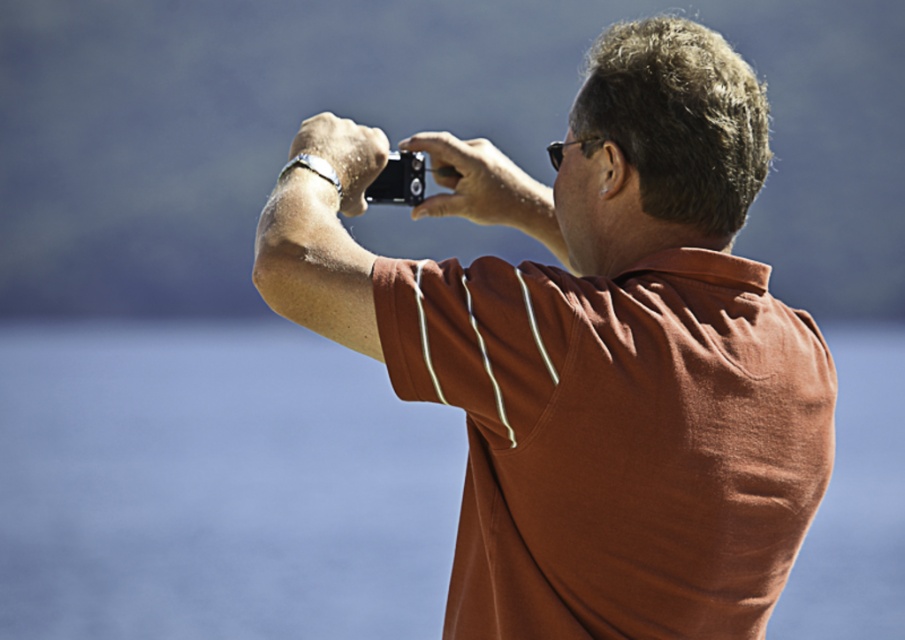
This screenshot has width=905, height=640. What do you see at coordinates (589, 349) in the screenshot?
I see `matte black camera at center` at bounding box center [589, 349].

Does point (627, 92) come in front of point (380, 195)?

Yes, it is.

Does point (303, 145) come farther from viewer compared to point (418, 198)?

No, it is in front of (418, 198).

Where is `matte black camera at center`? matte black camera at center is located at coordinates (589, 349).

Is transparent blue water at center thinner than black plastic camera at center?

No, transparent blue water at center is not thinner than black plastic camera at center.

Is transparent blue water at center above black plastic camera at center?

Incorrect, transparent blue water at center is not positioned above black plastic camera at center.

Does point (254, 480) come farther from viewer compared to point (386, 184)?

Yes, it is behind point (386, 184).

The height and width of the screenshot is (640, 905). I want to click on transparent blue water at center, so click(216, 486).

Who is more forward, [767,474] or [376,456]?

Point [767,474] is in front.

Is matte black camera at center below transparent blue water at center?

Actually, matte black camera at center is above transparent blue water at center.

Locate an element on the screen. The width and height of the screenshot is (905, 640). matte black camera at center is located at coordinates (589, 349).